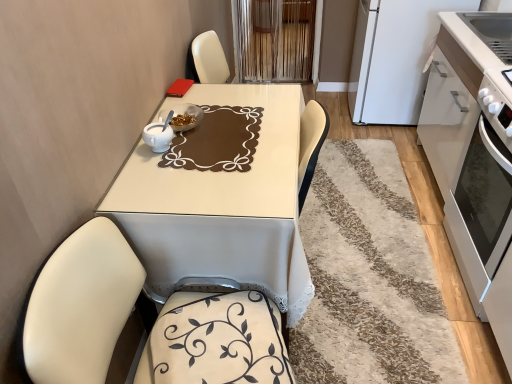
Question: Is white matte cabinet at right wider or thinner than white matte refrigerator at upper right?

Choices:
 (A) thin
 (B) wide

Answer: (A)

Question: Considering the positions of white matte cabinet at right and white matte refrigerator at upper right in the image, is white matte cabinet at right taller or shorter than white matte refrigerator at upper right?

Choices:
 (A) tall
 (B) short

Answer: (A)

Question: Considering the real-world distances, which object is farthest from the white matte refrigerator at upper right?

Choices:
 (A) white fabric swivel chair at lower left
 (B) white glossy table at center
 (C) white shaggy rug at center
 (D) white glossy oven at right
 (E) white matte cabinet at right

Answer: (A)

Question: Which of these objects is positioned closest to the white matte cabinet at right?

Choices:
 (A) white shaggy rug at center
 (B) white fabric swivel chair at lower left
 (C) white glossy oven at right
 (D) white glossy bowl at center
 (E) white matte refrigerator at upper right

Answer: (C)